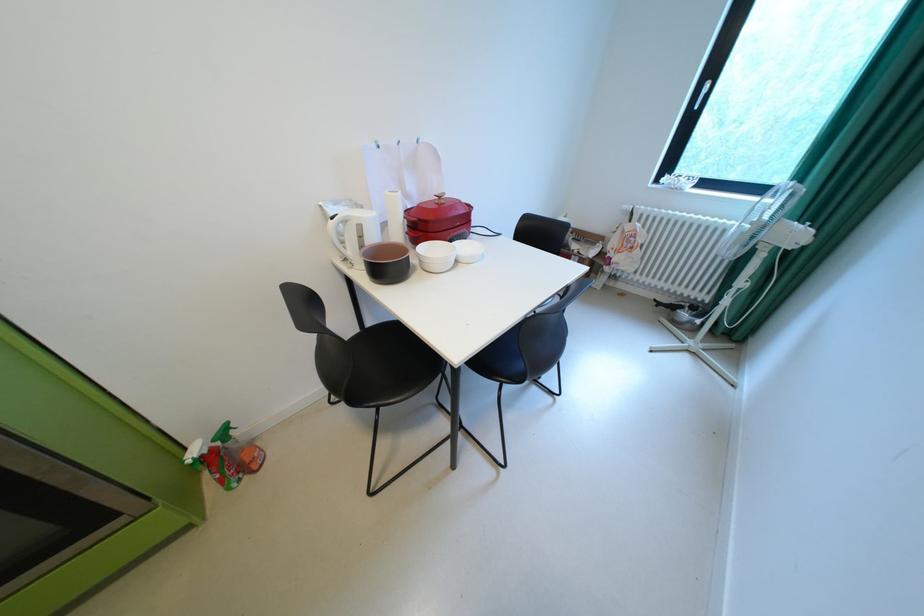
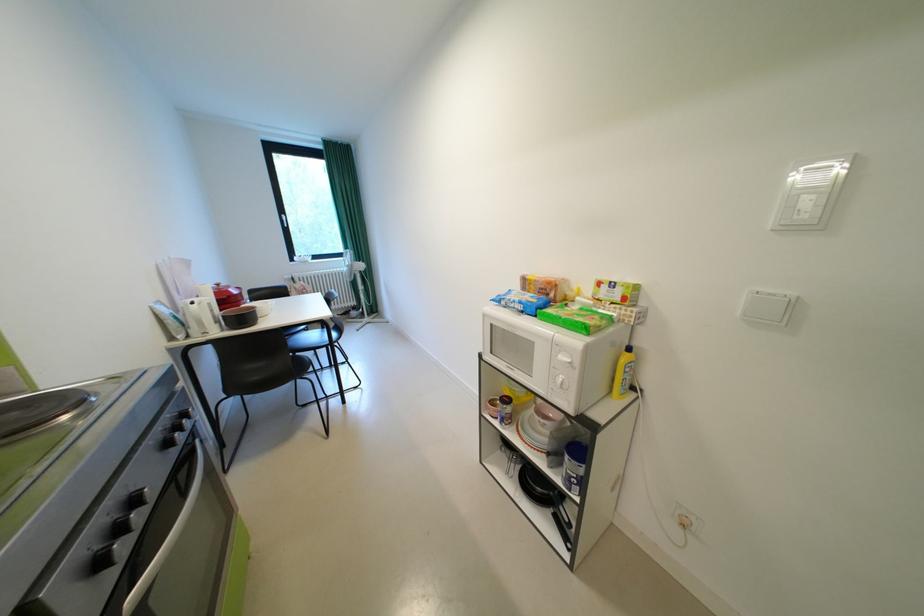
The point at [371,246] is marked in the first image. Where is the corresponding point in the second image?

(225, 317)